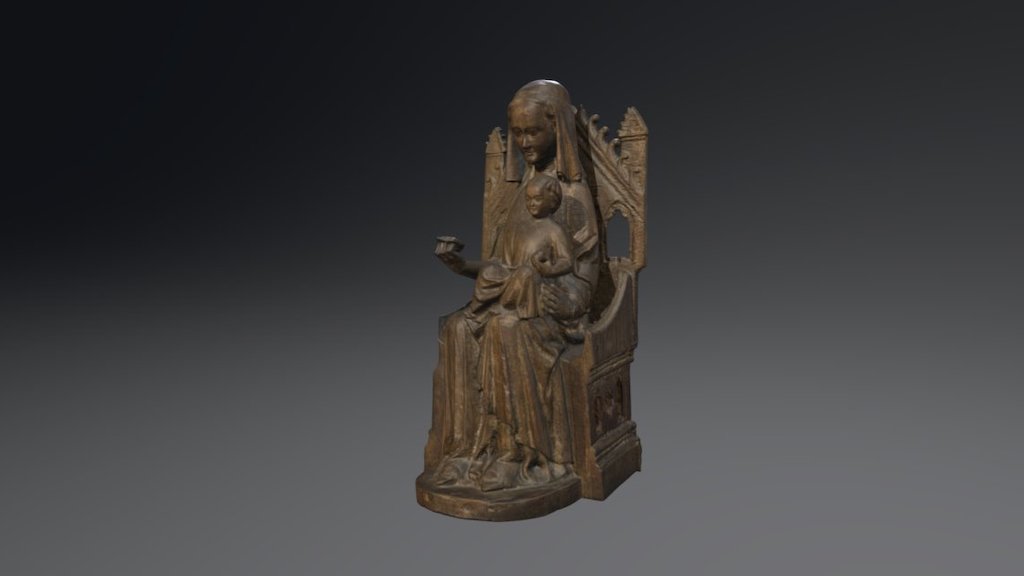
The image size is (1024, 576). In order to click on statue in this screenshot , I will do `click(585, 323)`.